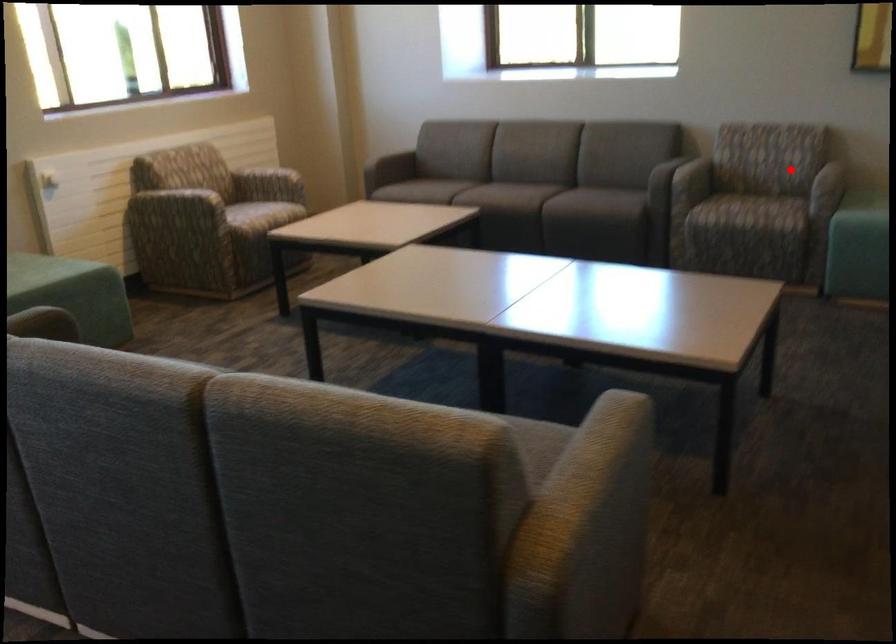
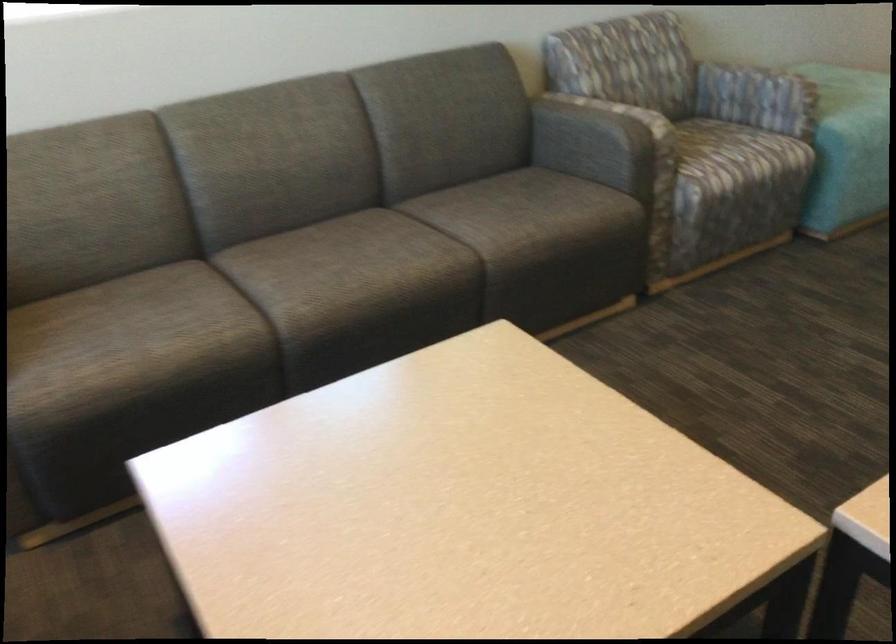
Locate, in the second image, the point that corresponds to the highlighted location in the first image.

(728, 84)